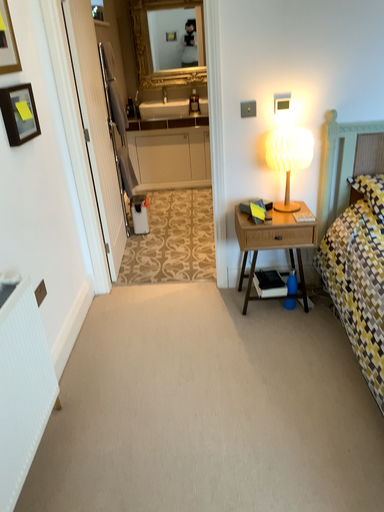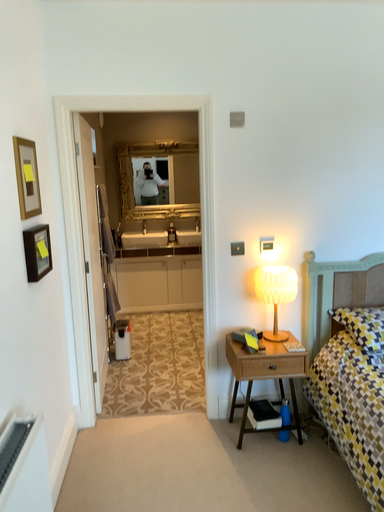
Question: How did the camera likely rotate when shooting the video?

Choices:
 (A) rotated upward
 (B) rotated downward

Answer: (A)